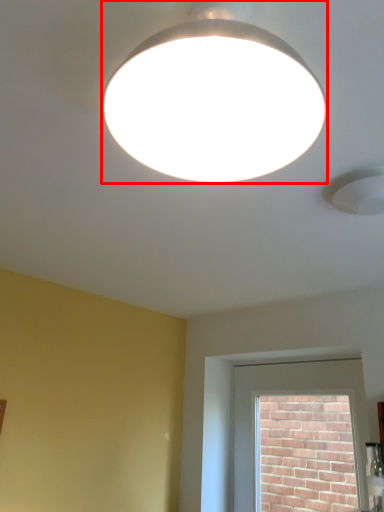
Question: From the image's perspective, where is lamp (annotated by the red box) located in relation to window in the image?

Choices:
 (A) above
 (B) below

Answer: (A)